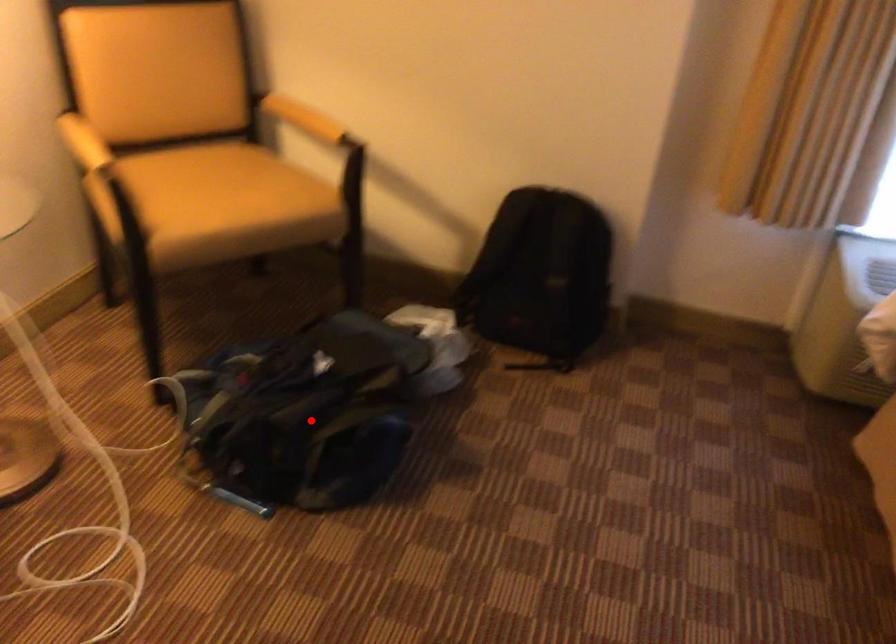
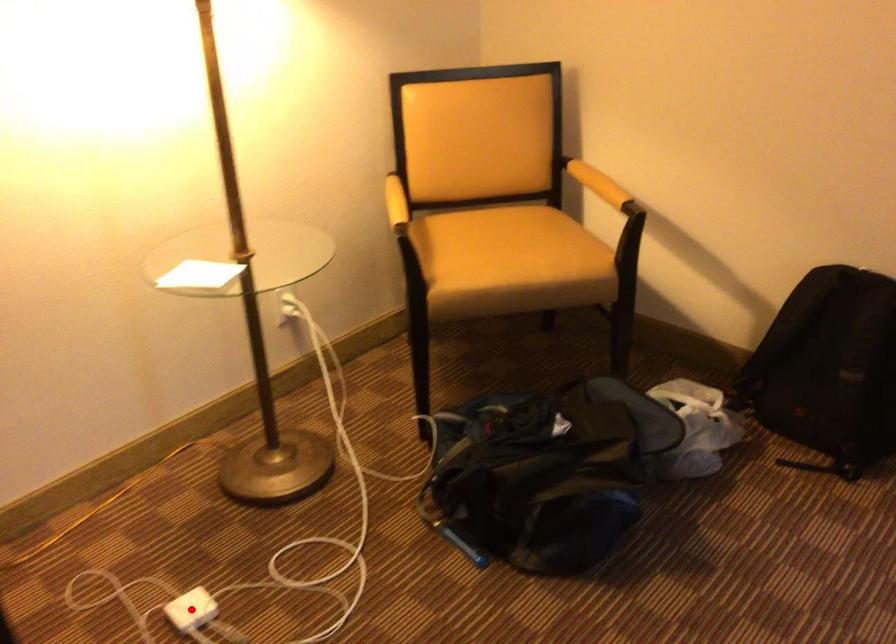
I am providing you with two images of the same scene from different viewpoints. A red point is marked on the first image and another point is marked on the second image. Do the highlighted points in image1 and image2 indicate the same real-world spot?

No